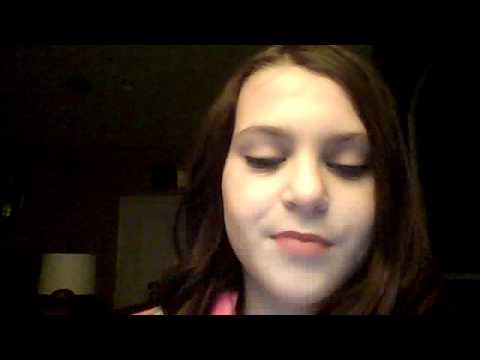
Identify the location of door. (138, 257).